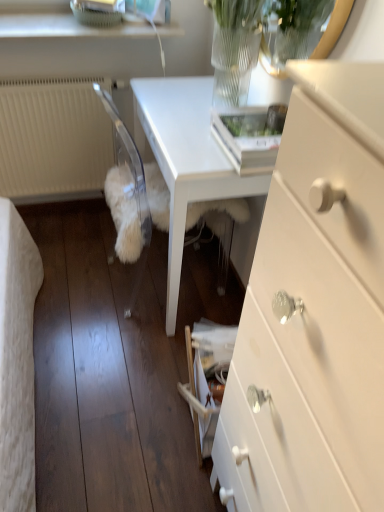
Locate an element on the screen. The width and height of the screenshot is (384, 512). free space above white textured radiator at left (from a real-world perspective) is located at coordinates (54, 75).